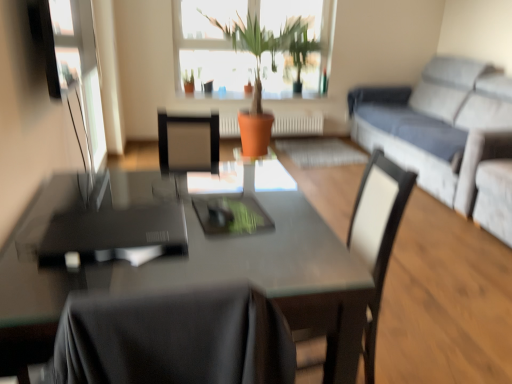
Question: Would you say terracotta clay pot at center is to the left or to the right of glossy glass table at center in the picture?

Choices:
 (A) right
 (B) left

Answer: (A)

Question: Considering their positions, is terracotta clay pot at center located in front of or behind glossy glass table at center?

Choices:
 (A) front
 (B) behind

Answer: (B)

Question: Considering the real-world distances, which object is farthest from the light gray fabric couch at right?

Choices:
 (A) white leather chair at center
 (B) glossy glass table at center
 (C) terracotta clay pot at center

Answer: (B)

Question: Which is farther from the white leather chair at center?

Choices:
 (A) glossy glass table at center
 (B) light gray fabric couch at right
 (C) terracotta clay pot at center

Answer: (C)